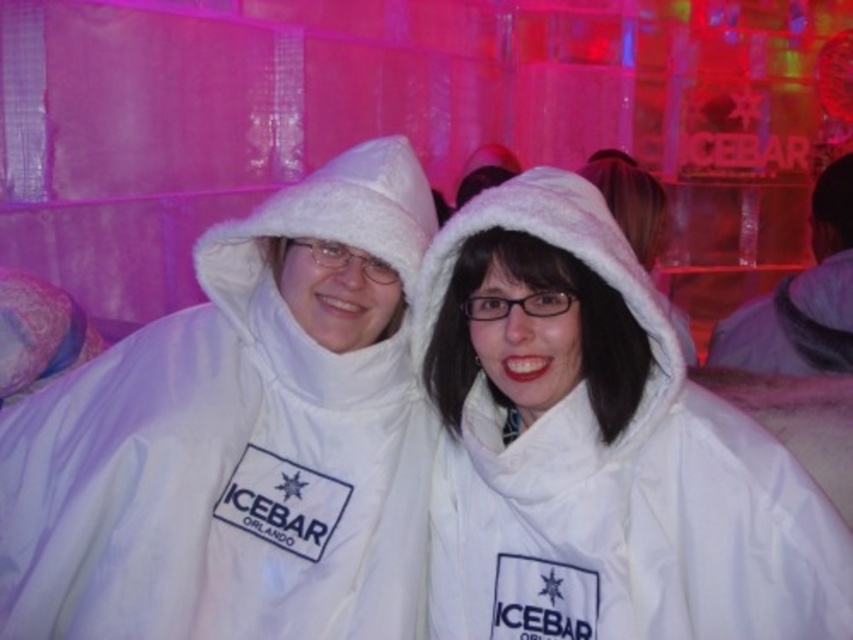
You are designing a display for a winter fashion show and need to arrange the white fleece coat at center and the white fleece robe at right. Based on their sizes, which one should be placed higher on the rack to ensure proper visibility?

The white fleece coat at center should be placed higher on the rack because it has a greater height compared to the white fleece robe at right, ensuring it is visible to viewers.

You are a photographer at the ICEBAR ORLANDO and want to capture a photo of the two people wearing the white fuzzy coat at center and the white fleece robe at right. Which clothing item is located to the left of the other?

The white fuzzy coat at center is positioned on the left side of white fleece robe at right.